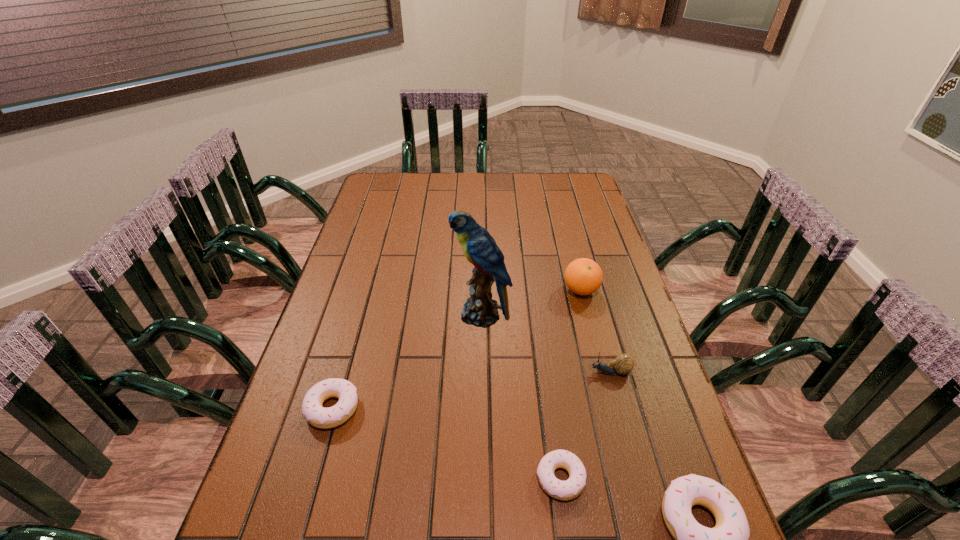
You are a GUI agent. You are given a task and a screenshot of the screen. Output one action in this format:
    pyautogui.click(x=<x>, y=<y>)
    Task: Click on the escargot located at the right edge
    
    Given the screenshot: What is the action you would take?
    [x=623, y=364]

You are a GUI agent. You are given a task and a screenshot of the screen. Output one action in this format:
    pyautogui.click(x=<x>, y=<y>)
    Task: Click on the free point at the far edge
    This screenshot has height=540, width=960.
    Given the screenshot: What is the action you would take?
    pyautogui.click(x=502, y=177)

Locate an element on the screen. The height and width of the screenshot is (540, 960). vacant space at the near edge of the desktop is located at coordinates (578, 500).

In the image, there is a desktop. At what (x,y) coordinates should I click in order to perform the action: click on vacant space at the left edge. Please return your answer as a coordinate pair (x, y). Looking at the image, I should click on (355, 256).

In the image, there is a desktop. In order to click on vacant area at the right edge in this screenshot , I will do `click(613, 356)`.

At what (x,y) coordinates should I click in order to perform the action: click on vacant space at the far left corner. Please return your answer as a coordinate pair (x, y). The width and height of the screenshot is (960, 540). Looking at the image, I should click on (385, 201).

This screenshot has width=960, height=540. I want to click on free spot between the fourth farthest object and the orange, so click(457, 349).

This screenshot has width=960, height=540. I want to click on free space between the second doughnut from left to right and the leftmost object, so click(446, 443).

The width and height of the screenshot is (960, 540). What are the coordinates of `vacant space that is in between the tallest object and the fourth object from right to left` in the screenshot? It's located at (520, 396).

Where is `vacant area between the orange and the escargot`? This screenshot has height=540, width=960. vacant area between the orange and the escargot is located at coordinates (595, 331).